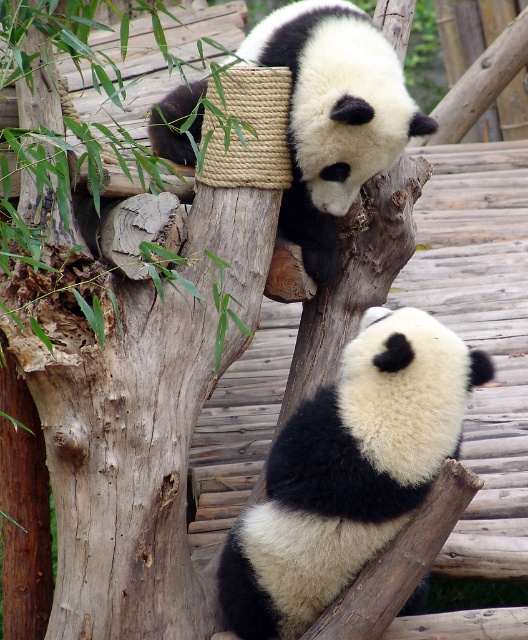
Question: Among these objects, which one is farthest from the camera?

Choices:
 (A) black and white fur panda at upper center
 (B) black fuzzy panda at center

Answer: (A)

Question: Which point is farther from the camera taking this photo?

Choices:
 (A) (396, 368)
 (B) (344, 212)

Answer: (B)

Question: Considering the relative positions of black fuzzy panda at center and black and white fur panda at upper center in the image provided, where is black fuzzy panda at center located with respect to black and white fur panda at upper center?

Choices:
 (A) right
 (B) left

Answer: (A)

Question: Can you confirm if black fuzzy panda at center is bigger than black and white fur panda at upper center?

Choices:
 (A) no
 (B) yes

Answer: (A)

Question: In this image, where is black fuzzy panda at center located relative to black and white fur panda at upper center?

Choices:
 (A) above
 (B) below

Answer: (B)